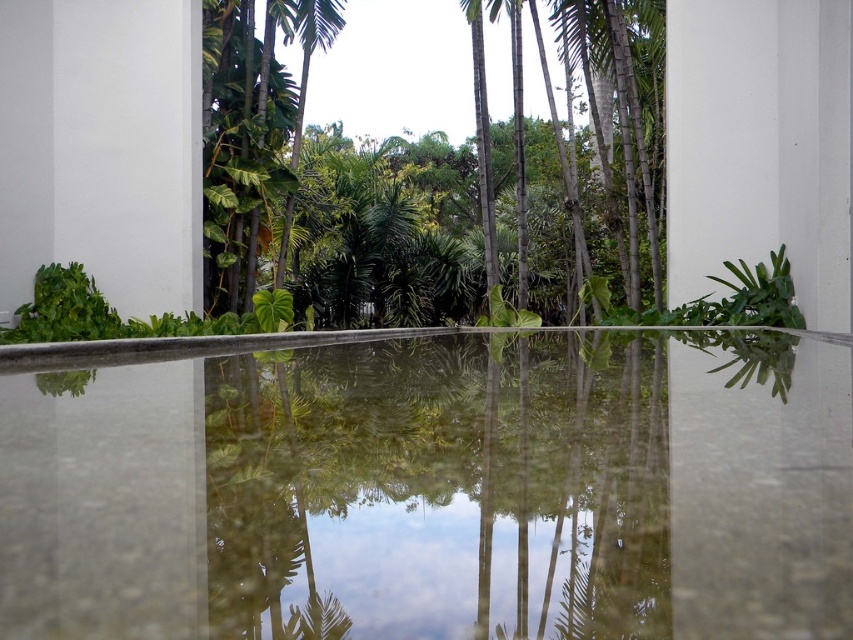
Is clear water at center to the right of green leafy tree at center from the viewer's perspective?

In fact, clear water at center is to the left of green leafy tree at center.

Does point (498, 380) come in front of point (624, 209)?

Yes, it is in front of point (624, 209).

Where is `clear water at center`? This screenshot has height=640, width=853. clear water at center is located at coordinates (434, 490).